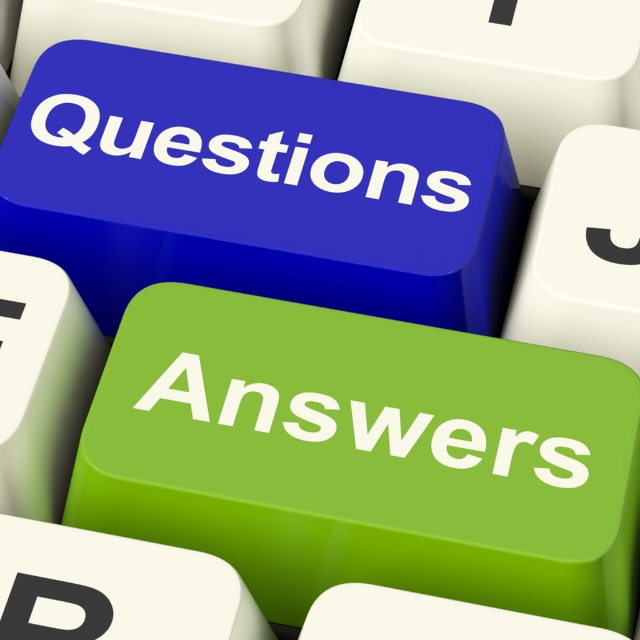
What is located at the point with coordinates (x=240, y=154) on the keyboard?

The point at coordinates (x=240, y=154) on the keyboard is where the blue plastic questions key is located.